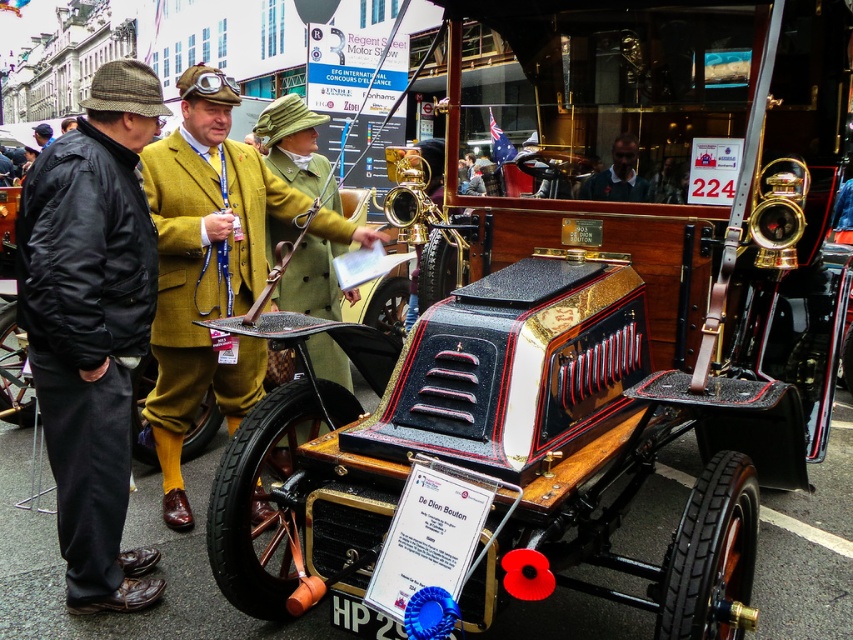
Consider the image. You are a photographer positioned at the point labeled as point [91,324]. You want to capture a photo of the De Dion Bouton automobile in the foreground. Is the wooden coach at left blocking your view of the De Dion Bouton automobile?

The point [91,324] corresponds to the wooden coach at left, so you are standing at the wooden coach at left. Since the De Dion Bouton automobile is in the foreground, it is closer to you than the wooden coach at left, so the wooden coach at left is not blocking your view of the De Dion Bouton automobile.

You are a photographer standing at the point marked as point (x=209, y=371). You want to take a photo of the De Dion Bouton automobile. Considering the distance between you and the car is 3.90 meters, will your 50mm lens capture the entire car in the frame? Assume the camera sensor size is 36mm x 24mm and the field of view at 50mm is approximately 46 degrees horizontally.

The distance between the photographer at point (x=209, y=371) and the De Dion Bouton automobile is 3.90 meters. Using the 50mm lens with a horizontal field of view of 46 degrees, the maximum width that can be captured is approximately 3.90 meters multiplied by the tangent of half the angle, which is tan 23 degrees. Calculating this gives roughly 3.90m x 0.424 equals 1.65 meters. The De Dion Bouton automobile is a classic open vehicle with a wooden body, likely around 3 meters long. Since 3 meters exceeds 1.65

You are a photographer at the Regent Street Motor Show. You want to take a photo of the De Dion Bouton automobile with its plaque and the vintage car show signage in the background. The wooden coach at left is blocking your view. Where should you move to get an unobstructed view of the De Dion Bouton automobile and the signage?

Move to the right of the wooden coach at left to avoid obstruction and ensure both the De Dion Bouton automobile and the vintage car show signage are visible in your photo.